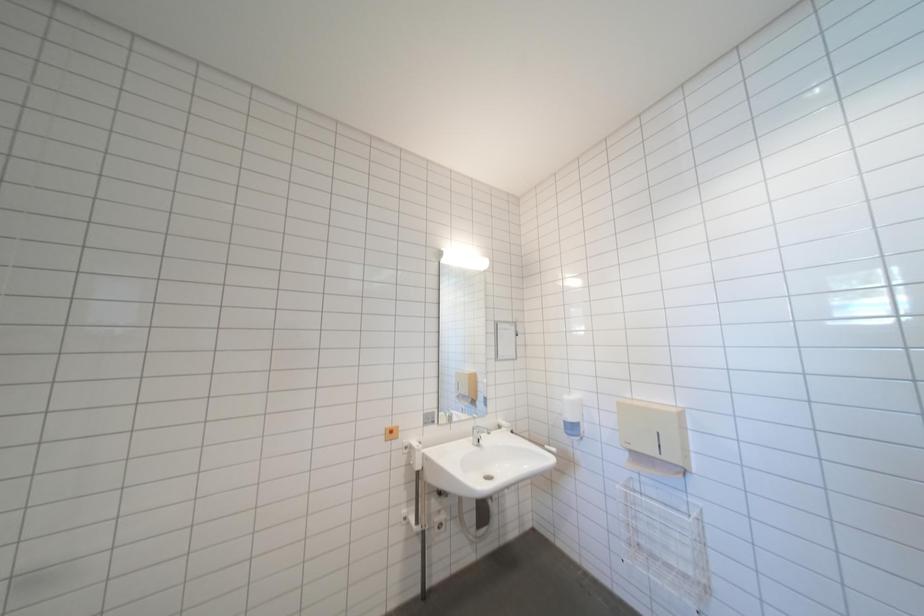
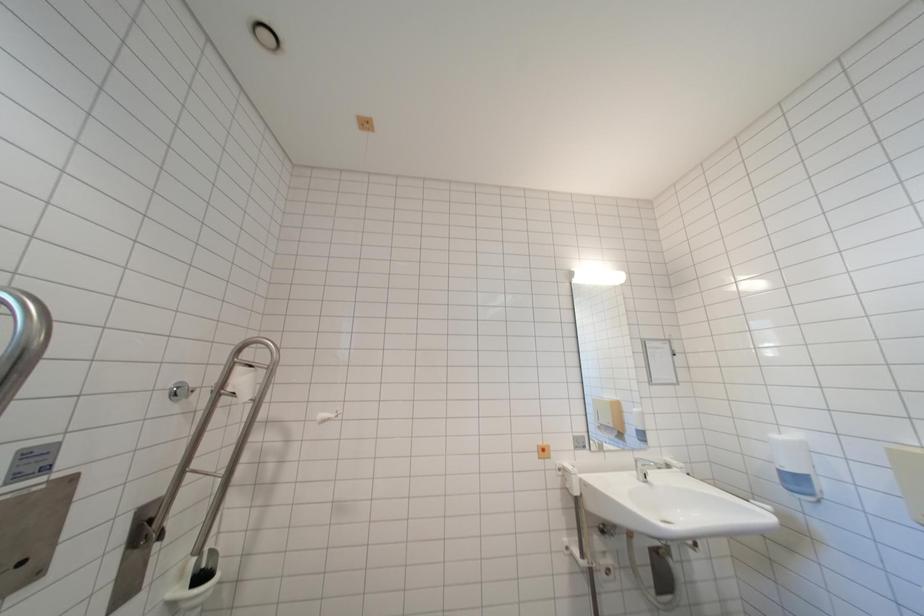
Which direction would the cameraman need to move to produce the second image?

The cameraman walked toward left, backward.